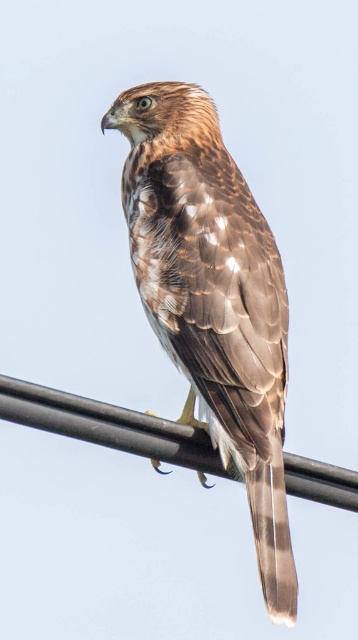
Is point (177, 81) more distant than point (10, 420)?

Yes.

Who is more distant from viewer, (201, 289) or (26, 420)?

The point (201, 289) is more distant.

What are the coordinates of `brown feathered eagle at center` in the screenshot? It's located at (213, 300).